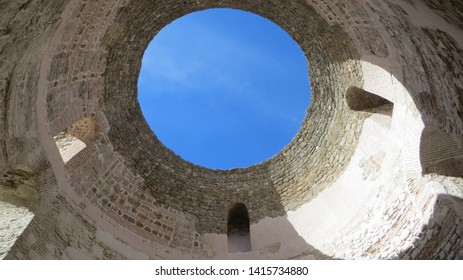
The image size is (463, 280). Identify the location of picture. (245, 135).